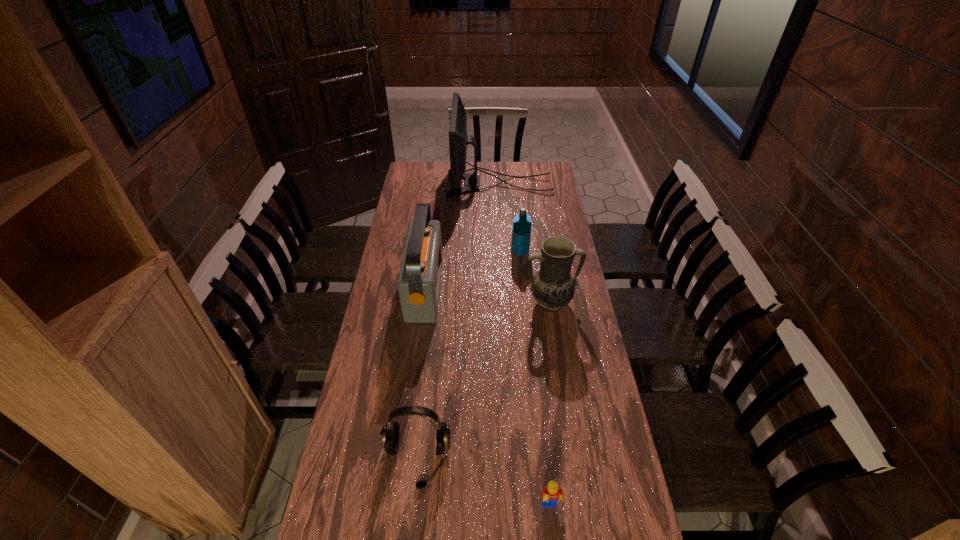
Image resolution: width=960 pixels, height=540 pixels. Find the location of `vacant area that lies between the nearest object and the computer monitor`. vacant area that lies between the nearest object and the computer monitor is located at coordinates (525, 345).

At what (x,y) coordinates should I click in order to perform the action: click on free space between the shortest object and the thermos bottle. Please return your answer as a coordinate pair (x, y). The image size is (960, 540). Looking at the image, I should click on (535, 379).

Locate an element on the screen. The height and width of the screenshot is (540, 960). vacant space in between the Lego and the radio receiver is located at coordinates (488, 397).

Locate an element on the screen. Image resolution: width=960 pixels, height=540 pixels. free spot between the thermos bottle and the radio receiver is located at coordinates (472, 270).

This screenshot has height=540, width=960. Find the location of `object that stands as the fourth closest to the farthest object`. object that stands as the fourth closest to the farthest object is located at coordinates (x=390, y=432).

Find the location of `object that is the third closest to the pottery`. object that is the third closest to the pottery is located at coordinates (x=390, y=432).

At what (x,y) coordinates should I click in order to perform the action: click on free space that satisfies the following two spatial constraints: 1. on the screen side of the pottery; 2. on the left side of the farthest object. Please return your answer as a coordinate pair (x, y). The image size is (960, 540). Looking at the image, I should click on (507, 303).

What are the coordinates of `free region that satisfies the following two spatial constraints: 1. on the front-facing side of the pottery; 2. on the left side of the radio receiver` in the screenshot? It's located at (423, 303).